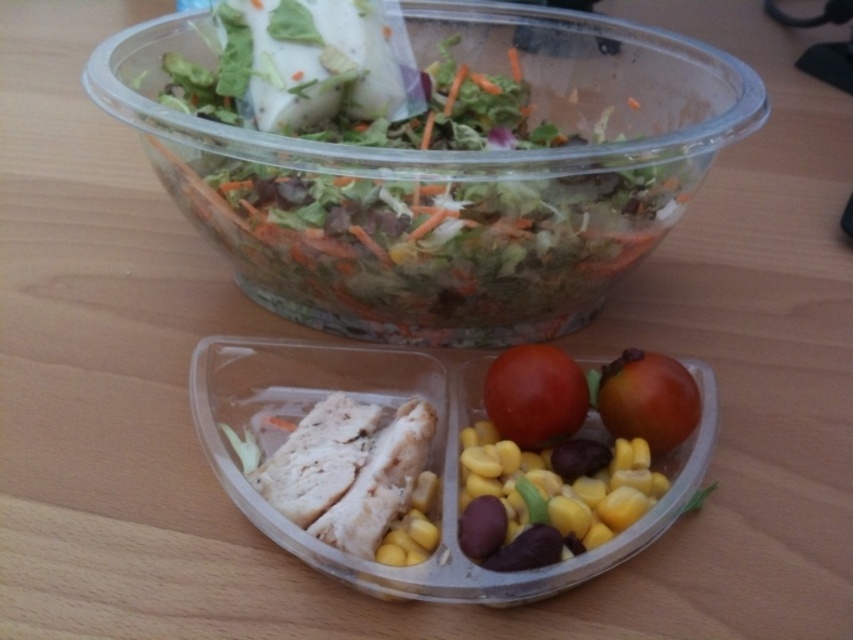
Question: Which point is closer to the camera?

Choices:
 (A) translucent plastic bowl at upper center
 (B) red matte tomato at center
 (C) glossy red tomato at center

Answer: (B)

Question: Can you confirm if red matte tomato at center is positioned to the right of glossy red tomato at center?

Choices:
 (A) no
 (B) yes

Answer: (A)

Question: In this image, where is translucent plastic bowl at upper center located relative to glossy red tomato at center?

Choices:
 (A) right
 (B) left

Answer: (B)

Question: Does translucent plastic bowl at upper center have a larger size compared to glossy red tomato at center?

Choices:
 (A) no
 (B) yes

Answer: (B)

Question: Which object is positioned farthest from the glossy red tomato at center?

Choices:
 (A) red matte tomato at center
 (B) translucent plastic bowl at upper center

Answer: (B)

Question: Which point is closer to the camera?

Choices:
 (A) red matte tomato at center
 (B) glossy red tomato at center

Answer: (A)